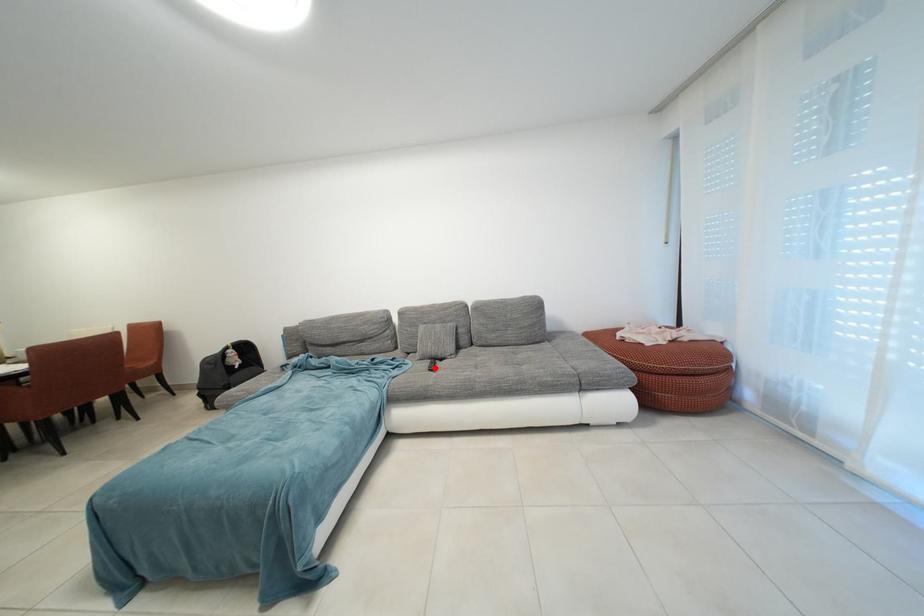
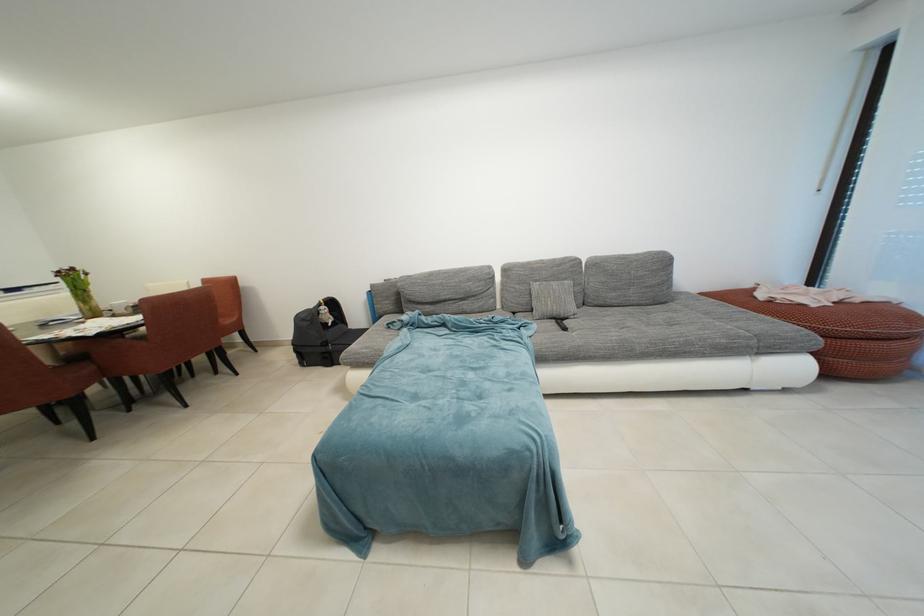
Where in the second image is the point corresponding to the highlighted location from the first image?

(560, 328)